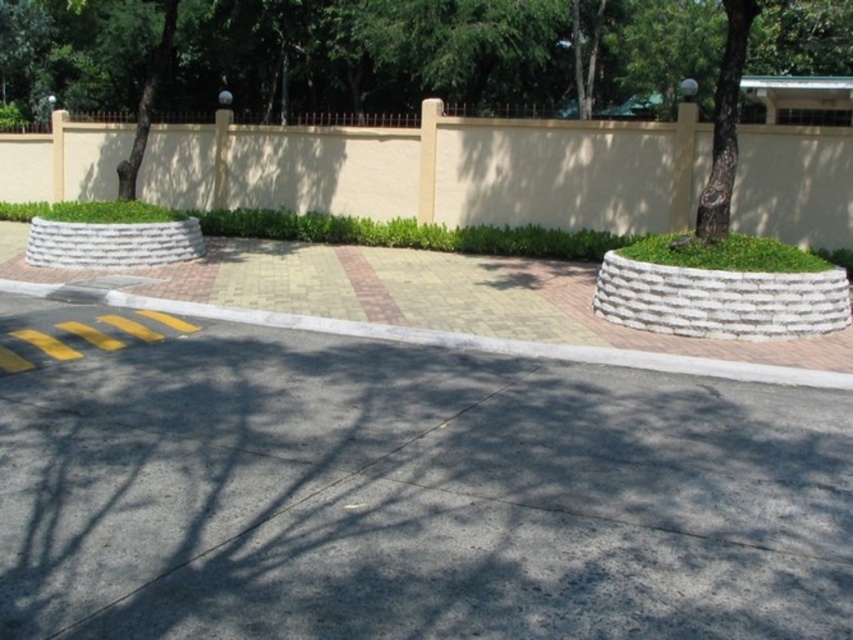
You are a delivery person trying to park your bike. You see the gray asphalt pavement at center and the yellow brick curb at center. Which surface should you park your bike on?

You should park your bike on the gray asphalt pavement at center because it is positioned under the yellow brick curb at center, making it the appropriate surface for parking.

You are a delivery person trying to park your vehicle near the beige concrete wall at upper center and the yellow brick curb at center. Based on their positions, which object should you approach first if you are coming from the left side of the road?

The beige concrete wall at upper center is positioned on the left side of the yellow brick curb at center, so if you are coming from the left side of the road, you should approach the beige concrete wall at upper center first before reaching the yellow brick curb at center.

You are standing at the camera position and want to walk to both the point at coordinates [345,577] and the point at coordinates [595,228] in the image. Which point will you reach first?

You will reach point [345,577] first because it is closer to the camera than point [595,228].